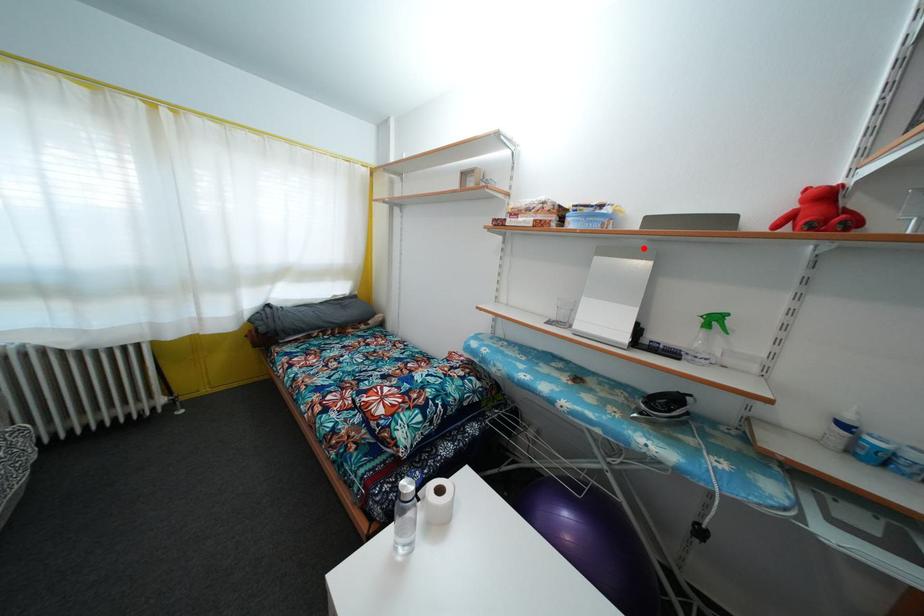
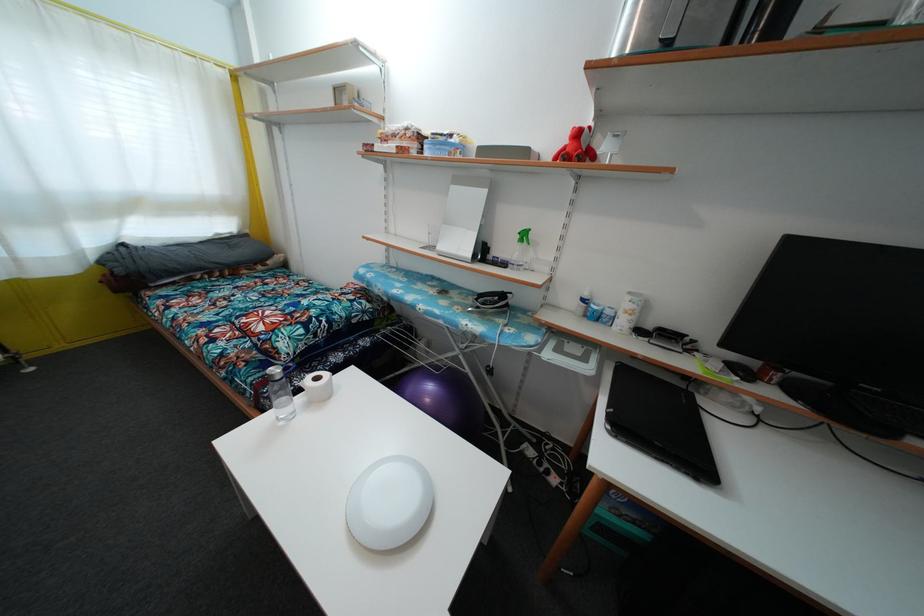
Find the pixel in the second image that matches the highlighted location in the first image.

(488, 177)